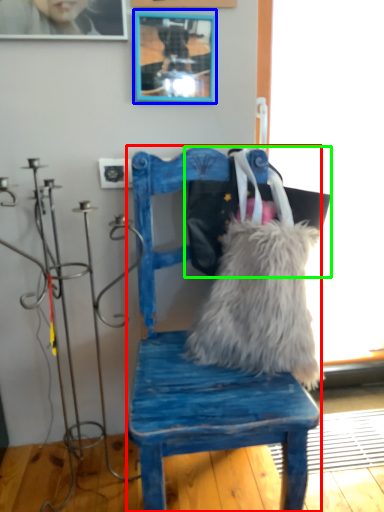
Question: Which object is the closest to the chair (highlighted by a red box)? Choose among these: picture frame (highlighted by a blue box) or messenger bag (highlighted by a green box).

Choices:
 (A) picture frame
 (B) messenger bag

Answer: (B)